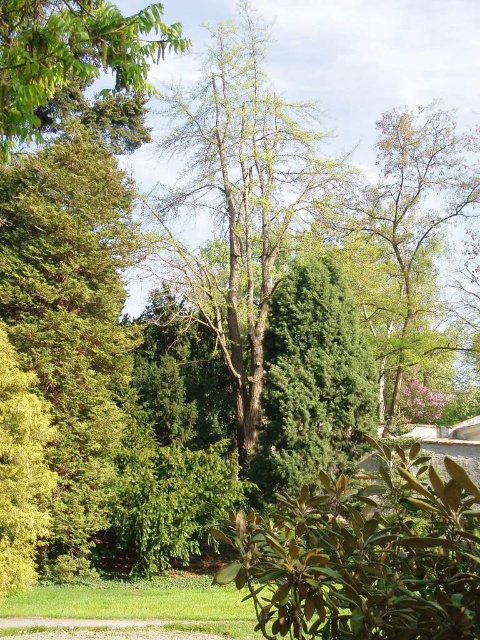
Which is more to the right, green leafy tree at upper right or green leafy tree at upper left?

green leafy tree at upper right

Is point (406, 272) positioned in front of point (23, 38)?

No, (406, 272) is further to viewer.

Where is `green leafy tree at upper right`? The image size is (480, 640). green leafy tree at upper right is located at coordinates (408, 232).

You are a GUI agent. You are given a task and a screenshot of the screen. Output one action in this format:
    pyautogui.click(x=<x>, y=<y>)
    Task: Click on the green leafy tree at upper right
    This screenshot has height=640, width=480.
    Given the screenshot: What is the action you would take?
    pyautogui.click(x=408, y=232)

Is green leafy tree at center to the left of green leafy tree at upper right from the viewer's perspective?

Yes, green leafy tree at center is to the left of green leafy tree at upper right.

Which is behind, point (222, 49) or point (416, 324)?

The point (222, 49) is behind.

Where is `green leafy tree at center`? green leafy tree at center is located at coordinates (240, 198).

Is green leafy tree at center to the left of green leathery leaves at lower center from the viewer's perspective?

No, green leafy tree at center is not to the left of green leathery leaves at lower center.

Is point (194, 284) positioned before point (412, 589)?

That is False.

Between point (231, 161) and point (386, 456), which one is positioned behind?

The point (231, 161) is behind.

Locate an element on the screen. The height and width of the screenshot is (640, 480). green leafy tree at center is located at coordinates 240,198.